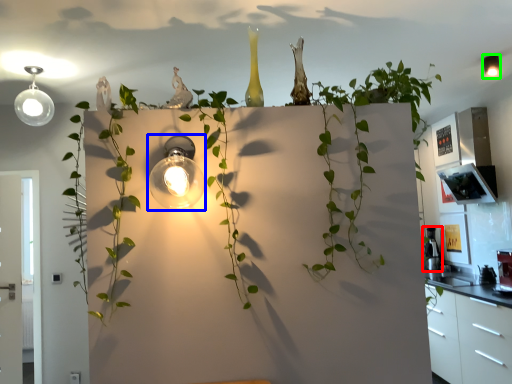
Question: Based on their relative distances, which object is nearer to appliance (highlighted by a red box)? Choose from light fixture (highlighted by a blue box) and light fixture (highlighted by a green box).

Choices:
 (A) light fixture
 (B) light fixture

Answer: (B)